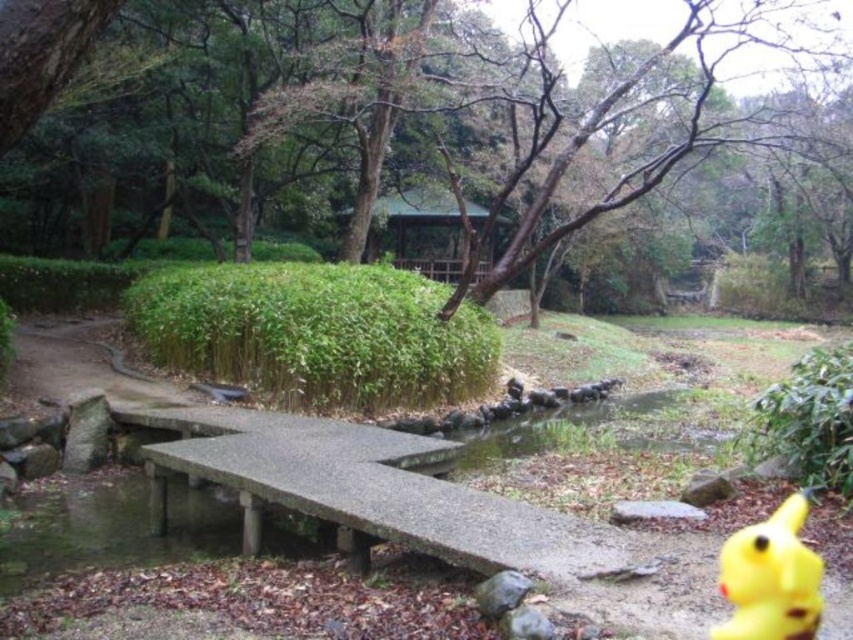
Question: Does gray concrete picnic table at center have a smaller size compared to yellow rubber duck at lower right?

Choices:
 (A) yes
 (B) no

Answer: (B)

Question: Which object is farther from the camera taking this photo?

Choices:
 (A) yellow rubber duck at lower right
 (B) gray concrete picnic table at center
 (C) green leafy tree at center

Answer: (B)

Question: Is gray concrete picnic table at center positioned behind yellow rubber duck at lower right?

Choices:
 (A) no
 (B) yes

Answer: (B)

Question: Is green leafy tree at center in front of yellow rubber duck at lower right?

Choices:
 (A) yes
 (B) no

Answer: (B)

Question: Which object appears closest to the camera in this image?

Choices:
 (A) green leafy tree at center
 (B) yellow rubber duck at lower right

Answer: (B)

Question: Which point is farther from the camera taking this photo?

Choices:
 (A) (759, 532)
 (B) (15, 1)

Answer: (A)